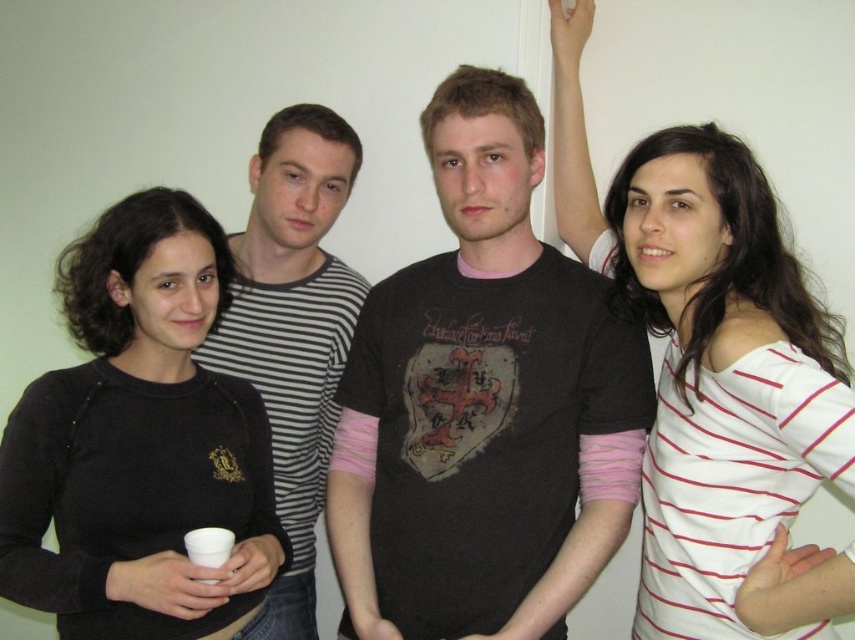
Which is behind, point (788, 381) or point (158, 486)?

The point (158, 486) is more distant.

Does point (611, 221) come behind point (57, 486)?

Yes, it is behind point (57, 486).

Is point (647, 468) closer to camera compared to point (234, 483)?

No, (647, 468) is further to viewer.

Locate an element on the screen. white striped shirt at center is located at coordinates (715, 374).

Who is positioned more to the left, black cotton t-shirt at center or striped cotton shirt at center?

striped cotton shirt at center

Who is higher up, black cotton t-shirt at center or striped cotton shirt at center?

black cotton t-shirt at center is above.

Between point (488, 163) and point (331, 344), which one is positioned behind?

The point (331, 344) is behind.

At what (x,y) coordinates should I click in order to perform the action: click on black cotton t-shirt at center. Please return your answer as a coordinate pair (x, y). The width and height of the screenshot is (855, 640). Looking at the image, I should click on (482, 404).

Who is higher up, black cotton t-shirt at center or white styrofoam cup at lower left?

Positioned higher is black cotton t-shirt at center.

Does black cotton t-shirt at center have a greater width compared to white styrofoam cup at lower left?

Yes.

Which is behind, point (452, 172) or point (228, 540)?

Positioned behind is point (452, 172).

At what (x,y) coordinates should I click in order to perform the action: click on black cotton t-shirt at center. Please return your answer as a coordinate pair (x, y). This screenshot has height=640, width=855. Looking at the image, I should click on tap(482, 404).